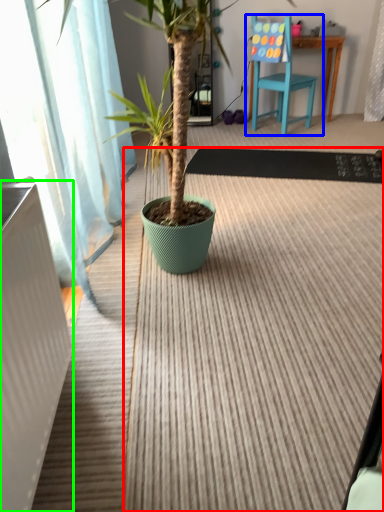
Question: Which is farther away from doormat (highlighted by a red box)? chair (highlighted by a blue box) or radiator (highlighted by a green box)?

Choices:
 (A) chair
 (B) radiator

Answer: (A)